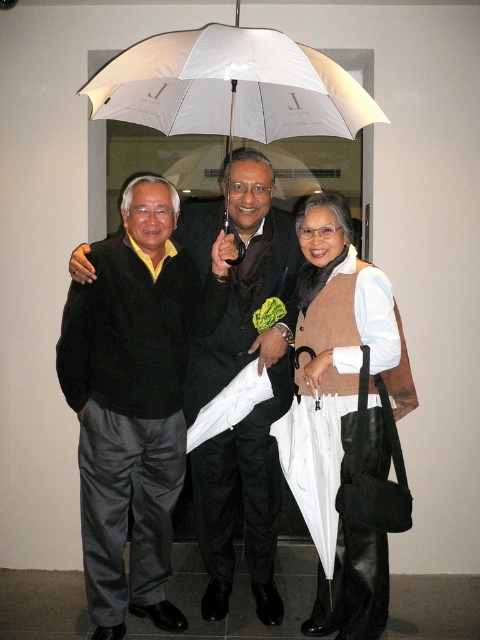
Which is above, black sweater at center or black satin suit at center?

black satin suit at center is higher up.

Which is behind, point (182, 461) or point (208, 586)?

The point (208, 586) is more distant.

Between point (159, 506) and point (256, 211), which one is positioned behind?

The point (159, 506) is more distant.

The image size is (480, 640). Identify the location of black sweater at center. (134, 397).

Between black sweater at center and white matte umbrella at center, which one appears on the right side from the viewer's perspective?

Positioned to the right is white matte umbrella at center.

At what (x,y) coordinates should I click in order to perform the action: click on black sweater at center. Please return your answer as a coordinate pair (x, y). The height and width of the screenshot is (640, 480). Looking at the image, I should click on (134, 397).

Is black satin suit at center below matte brown vest at center?

Actually, black satin suit at center is above matte brown vest at center.

I want to click on black satin suit at center, so click(255, 404).

Where is `black satin suit at center`? black satin suit at center is located at coordinates (255, 404).